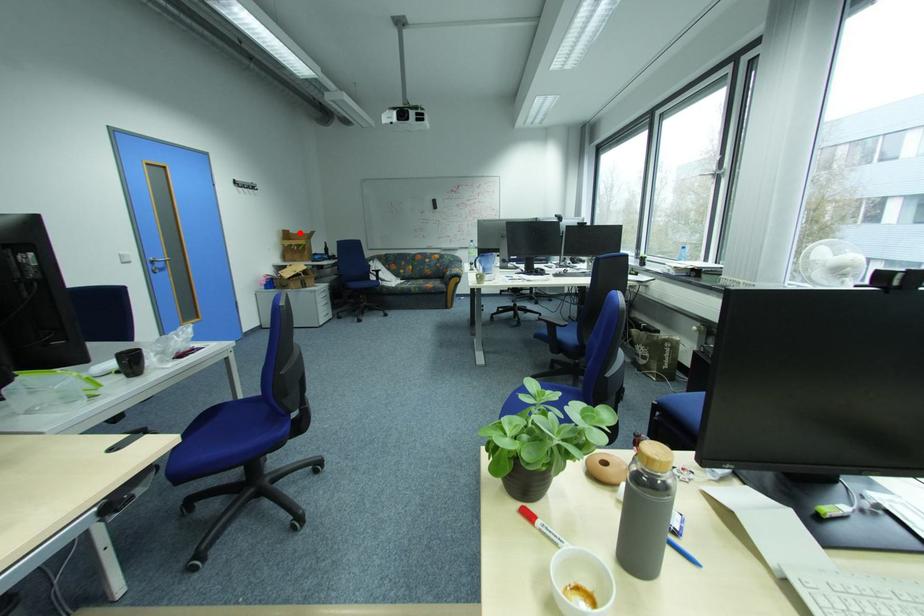
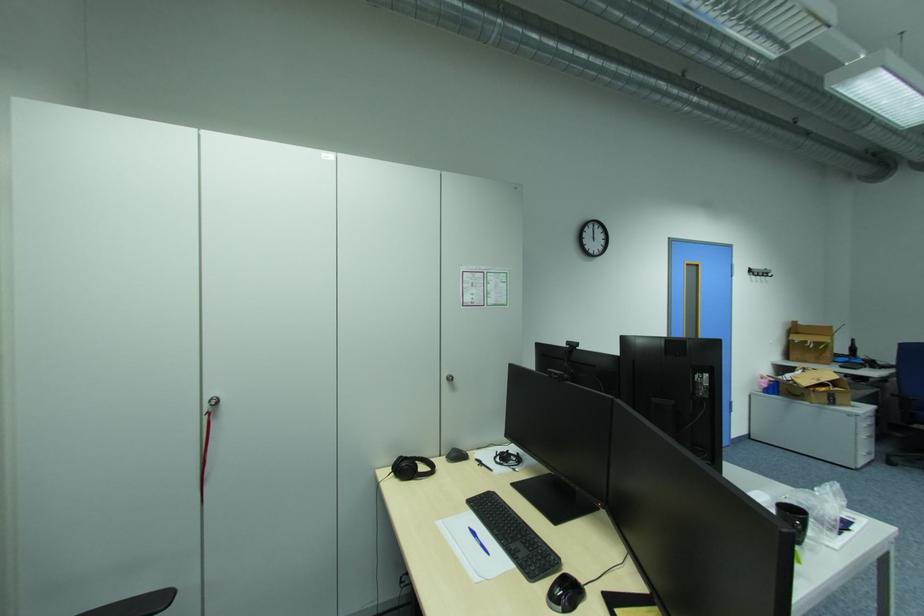
Question: I am providing you with two images of the same scene from different viewpoints. In image1, a red point is highlighted. Considering the same 3D point in image2, which of the following is correct?

Choices:
 (A) It is closer
 (B) It is farther

Answer: (B)